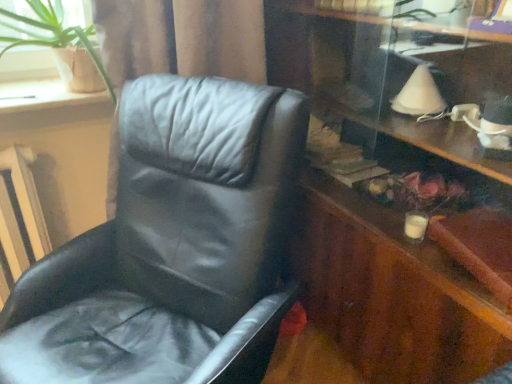
Question: From the image's perspective, does wooden dresser at right appear lower than green leafy plant at upper left?

Choices:
 (A) no
 (B) yes

Answer: (B)

Question: Considering the relative sizes of wooden dresser at right and green leafy plant at upper left in the image provided, is wooden dresser at right taller than green leafy plant at upper left?

Choices:
 (A) yes
 (B) no

Answer: (A)

Question: From a real-world perspective, is wooden dresser at right physically below green leafy plant at upper left?

Choices:
 (A) no
 (B) yes

Answer: (B)

Question: From a real-world perspective, is wooden dresser at right on green leafy plant at upper left?

Choices:
 (A) yes
 (B) no

Answer: (B)

Question: Considering the relative positions of wooden dresser at right and green leafy plant at upper left in the image provided, is wooden dresser at right behind green leafy plant at upper left?

Choices:
 (A) no
 (B) yes

Answer: (A)

Question: Does wooden dresser at right appear on the right side of green leafy plant at upper left?

Choices:
 (A) yes
 (B) no

Answer: (A)

Question: Does white textured radiator at left have a smaller size compared to wooden dresser at right?

Choices:
 (A) no
 (B) yes

Answer: (B)

Question: Is white textured radiator at left positioned with its back to wooden dresser at right?

Choices:
 (A) no
 (B) yes

Answer: (A)

Question: Is white textured radiator at left not near wooden dresser at right?

Choices:
 (A) yes
 (B) no

Answer: (A)

Question: Does white textured radiator at left have a lesser height compared to wooden dresser at right?

Choices:
 (A) no
 (B) yes

Answer: (B)

Question: Is white textured radiator at left at the right side of wooden dresser at right?

Choices:
 (A) no
 (B) yes

Answer: (A)

Question: Is white textured radiator at left behind wooden dresser at right?

Choices:
 (A) no
 (B) yes

Answer: (B)

Question: Can you confirm if black leather chair at left is thinner than green leafy plant at upper left?

Choices:
 (A) no
 (B) yes

Answer: (A)